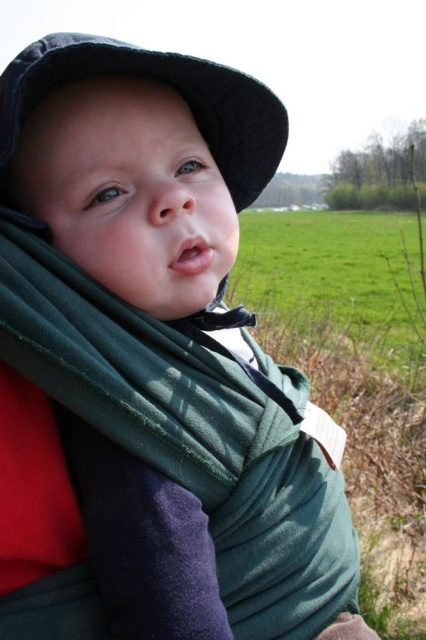
What are the coordinates of `green grass field at center` in the screenshot? It's located at (339, 278).

Identify the location of green grass field at center. [x=339, y=278].